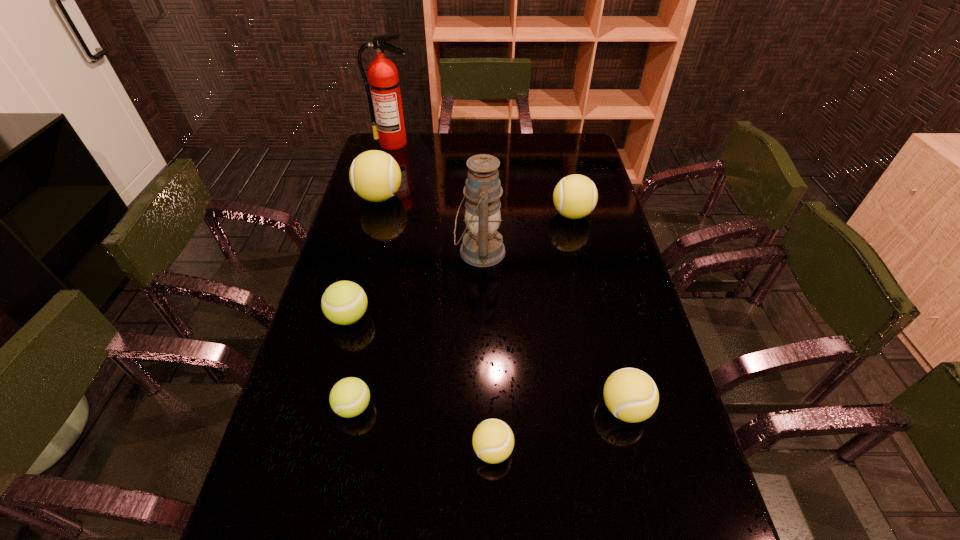
Identify the location of the farther green tennis ball. This screenshot has height=540, width=960. (344, 302).

Where is `the third tennis ball from right to left`? the third tennis ball from right to left is located at coordinates tap(493, 440).

Locate an element on the screen. The height and width of the screenshot is (540, 960). the third yellow tennis ball from right to left is located at coordinates (493, 440).

Where is `the smaller green tennis ball`? Image resolution: width=960 pixels, height=540 pixels. the smaller green tennis ball is located at coordinates (349, 397).

The height and width of the screenshot is (540, 960). Identify the location of vacant space located 0.330m on the side of the farthest object near the handle. (379, 197).

In order to click on vacant area situated on the right of the fourth farthest object in this screenshot , I will do `click(592, 252)`.

At what (x,y) coordinates should I click in order to perform the action: click on free space located on the front of the third tallest object. Please return your answer as a coordinate pair (x, y). The width and height of the screenshot is (960, 540). Looking at the image, I should click on pos(372,223).

This screenshot has height=540, width=960. Identify the location of vacant area situated on the back of the fifth shortest tennis ball. (560, 162).

The width and height of the screenshot is (960, 540). Find the location of `vacant space situated on the front of the second smallest yellow tennis ball`. vacant space situated on the front of the second smallest yellow tennis ball is located at coordinates (640, 473).

The width and height of the screenshot is (960, 540). Find the location of `vacant position located 0.380m on the back of the bigger green tennis ball`. vacant position located 0.380m on the back of the bigger green tennis ball is located at coordinates (375, 218).